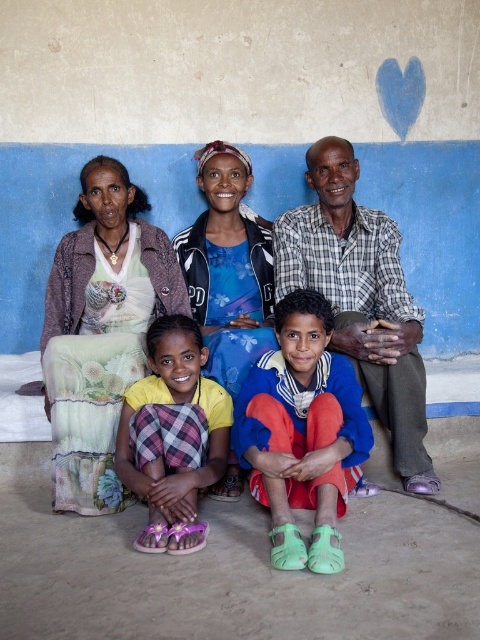
Question: Does floral print dress at left have a lesser width compared to blue fabric pants at lower center?

Choices:
 (A) yes
 (B) no

Answer: (B)

Question: Estimate the real-world distances between objects in this image. Which object is closer to the blue fabric pants at lower center?

Choices:
 (A) blue floral shirt at center
 (B) floral print dress at left

Answer: (A)

Question: Can you confirm if floral print dress at left is positioned above blue floral shirt at center?

Choices:
 (A) yes
 (B) no

Answer: (B)

Question: Which of the following is the closest to the observer?

Choices:
 (A) (286, 442)
 (B) (108, 403)

Answer: (A)

Question: Can you confirm if floral print dress at left is bigger than blue fabric pants at lower center?

Choices:
 (A) yes
 (B) no

Answer: (A)

Question: Which of the following is the closest to the observer?

Choices:
 (A) matte black jacket at center
 (B) blue fabric pants at lower center
 (C) yellow plaid skirt at lower left

Answer: (B)